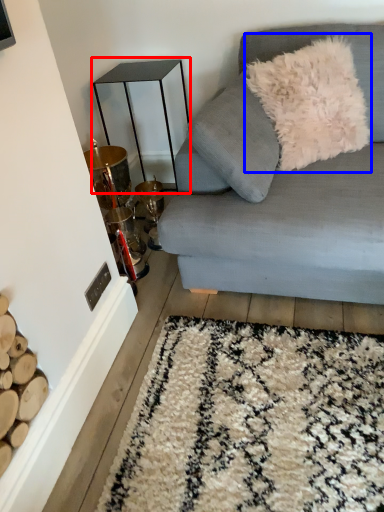
Question: Which object is further to the camera taking this photo, table (highlighted by a red box) or throw pillow (highlighted by a blue box)?

Choices:
 (A) table
 (B) throw pillow

Answer: (A)